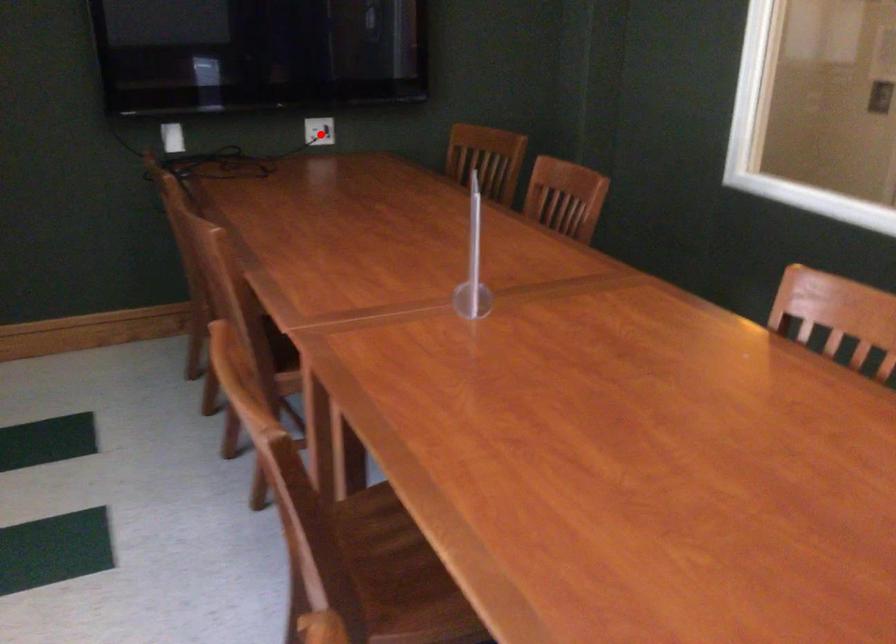
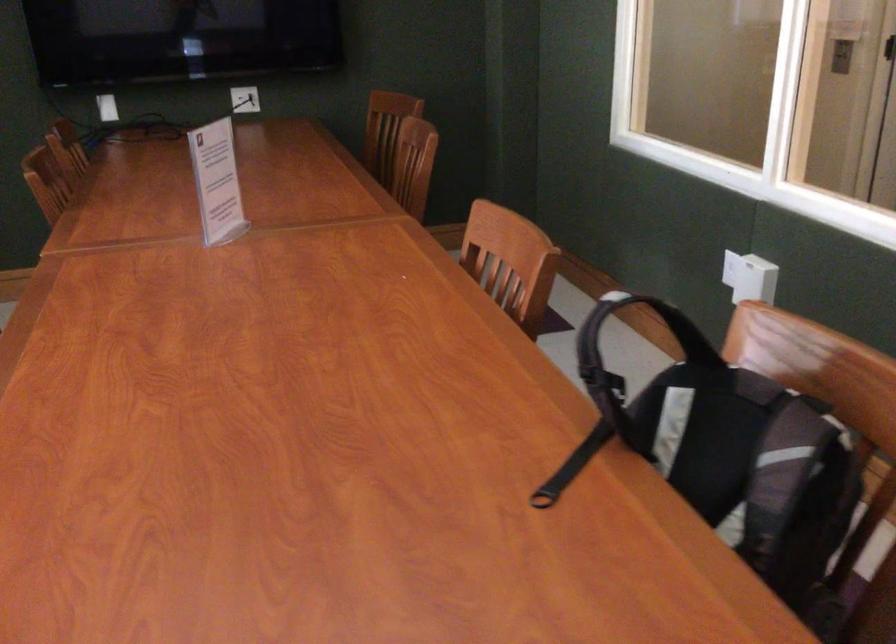
Find the pixel in the second image that matches the highlighted location in the first image.

(245, 99)